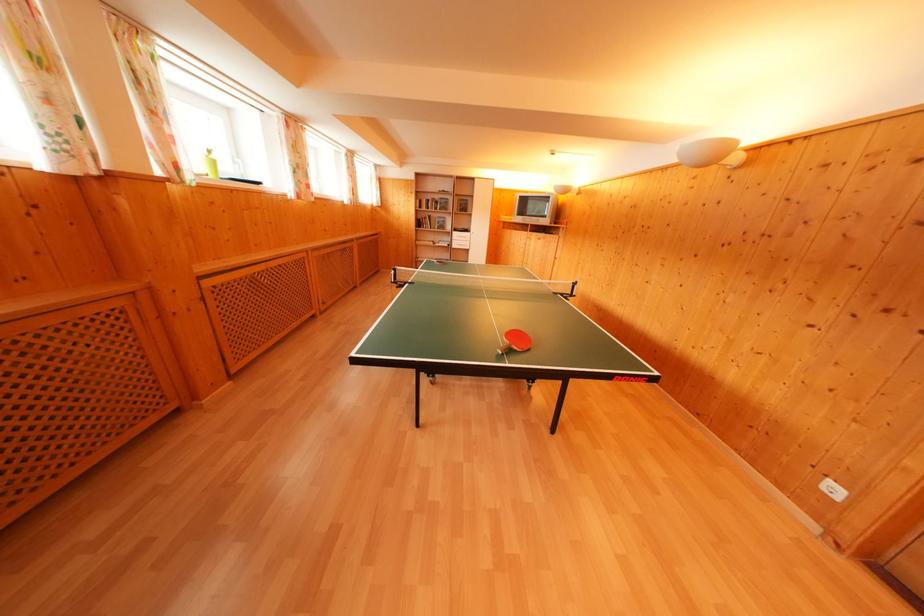
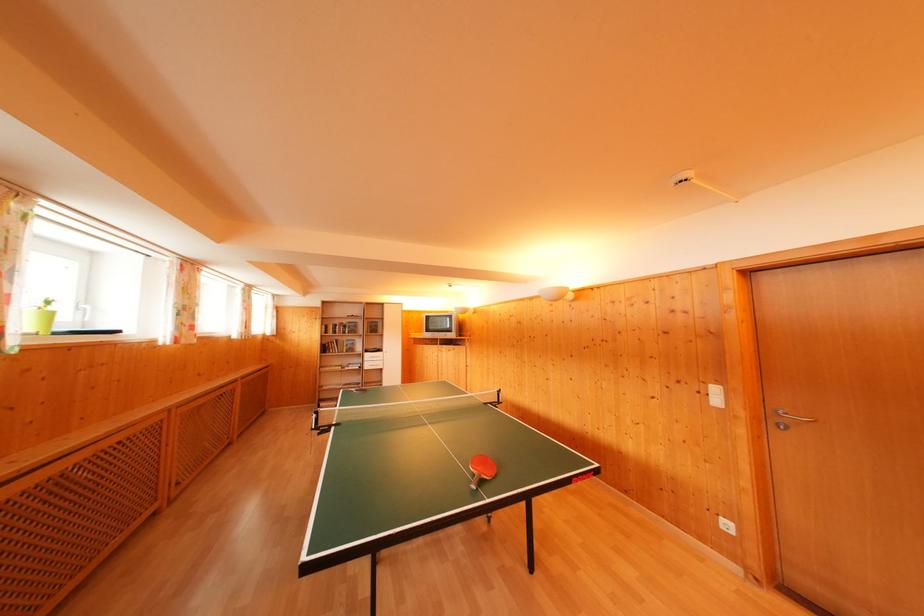
From the picture: Based on the continuous images, in which direction is the camera rotating?

The camera's rotation is toward right-up.